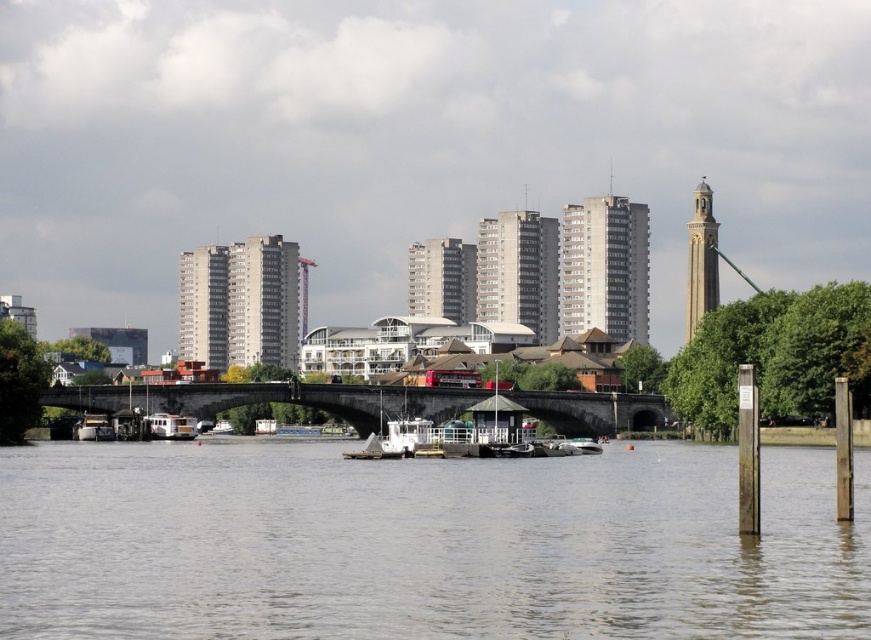
You are standing on the wooden post on the right side of the frame. You see a point marked at coordinates (423, 545). What is the color of the area where this point is located?

The point at coordinates (423, 545) is on gray water at center.

You are a photographer planning to capture the entire scene of the gray water at center and the white matte boat at center in one shot. Given that your camera has a limited field of view, which object should you prioritize framing closer to ensure both are visible?

Since the gray water at center is larger in size than the white matte boat at center, you should prioritize framing the white matte boat at center closer to ensure both fit within the camera frame.

From the picture: You are a boat captain navigating through the gray water at center and the stone bridge at center. Which object is closer to you as you approach the scene from the water?

The gray water at center is closer to you because it is in front of the stone bridge at center, meaning the bridge is further back in the scene.